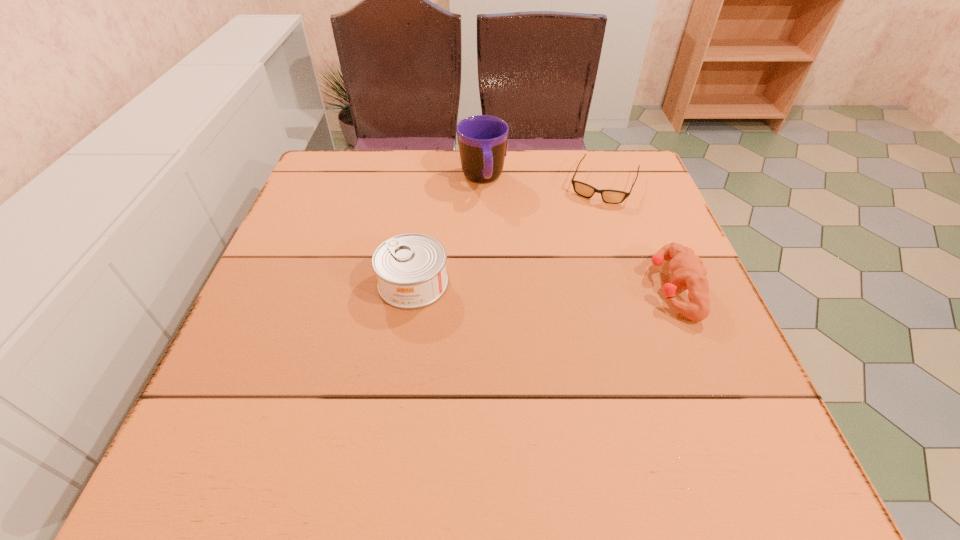
What are the coordinates of `free spot that satisfies the following two spatial constraints: 1. on the front side of the shortest object; 2. with the gloves of the puncher facing forward` in the screenshot? It's located at (640, 288).

The height and width of the screenshot is (540, 960). Find the location of `vacant region that satisfies the following two spatial constraints: 1. on the back side of the tallest object; 2. on the right side of the leftmost object`. vacant region that satisfies the following two spatial constraints: 1. on the back side of the tallest object; 2. on the right side of the leftmost object is located at coordinates (428, 180).

What are the coordinates of `free spot that satisfies the following two spatial constraints: 1. on the front side of the can; 2. with the gloves of the puncher facing forward` in the screenshot? It's located at (413, 288).